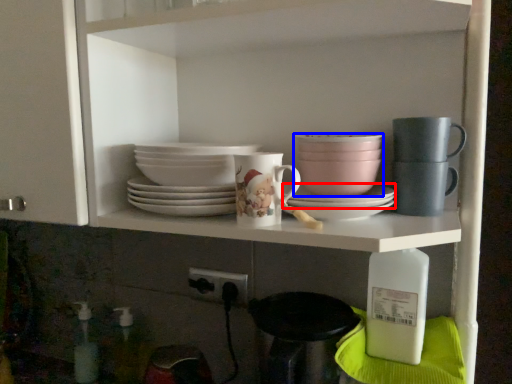
Question: Which of the following is the farthest to the observer, platter (highlighted by a red box) or tableware (highlighted by a blue box)?

Choices:
 (A) platter
 (B) tableware

Answer: (B)